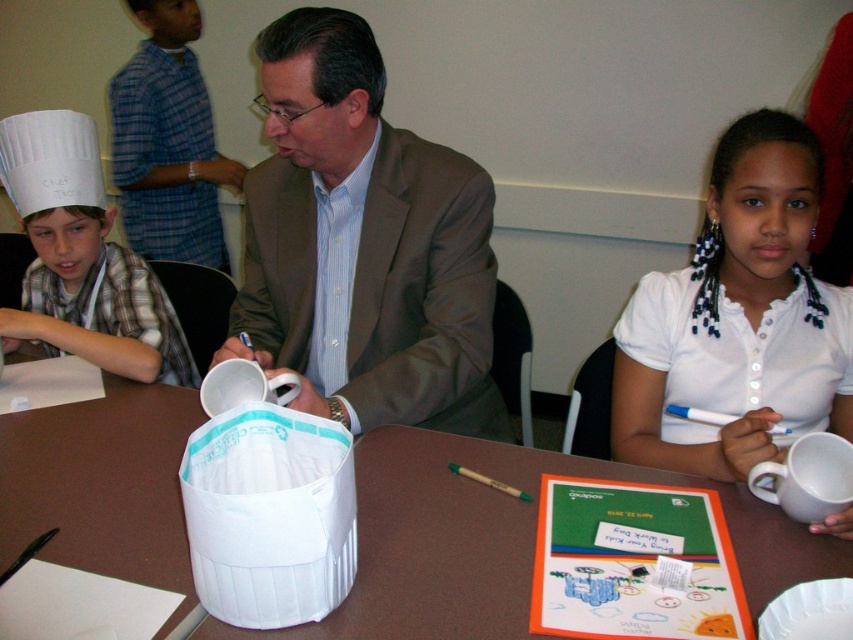
Question: Is the position of brown paper table at center more distant than that of white paper plate at lower right?

Choices:
 (A) no
 (B) yes

Answer: (B)

Question: Is the position of brown fabric suit at center more distant than that of brown paper table at center?

Choices:
 (A) no
 (B) yes

Answer: (B)

Question: Which point is closer to the camera taking this photo?

Choices:
 (A) (115, 557)
 (B) (36, 291)
 (C) (840, 636)
 (D) (276, 177)

Answer: (C)

Question: Is brown fabric suit at center closer to camera compared to white paper plate at lower right?

Choices:
 (A) no
 (B) yes

Answer: (A)

Question: Estimate the real-world distances between objects in this image. Which object is closer to the white paper chef hat at left?

Choices:
 (A) white paper plate at lower right
 (B) brown fabric suit at center

Answer: (B)

Question: Which of the following is the farthest from the observer?

Choices:
 (A) brown fabric suit at center
 (B) white paper plate at lower right

Answer: (A)